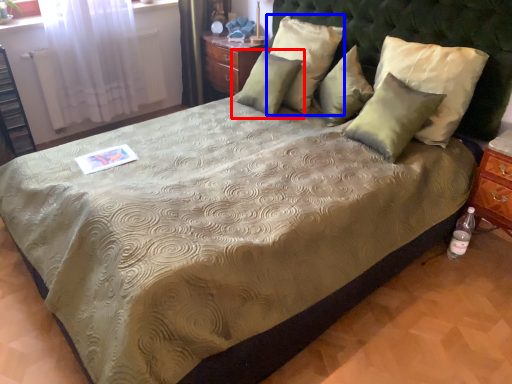
Question: Which object appears farthest to the camera in this image, pillow (highlighted by a red box) or pillow (highlighted by a blue box)?

Choices:
 (A) pillow
 (B) pillow

Answer: (A)